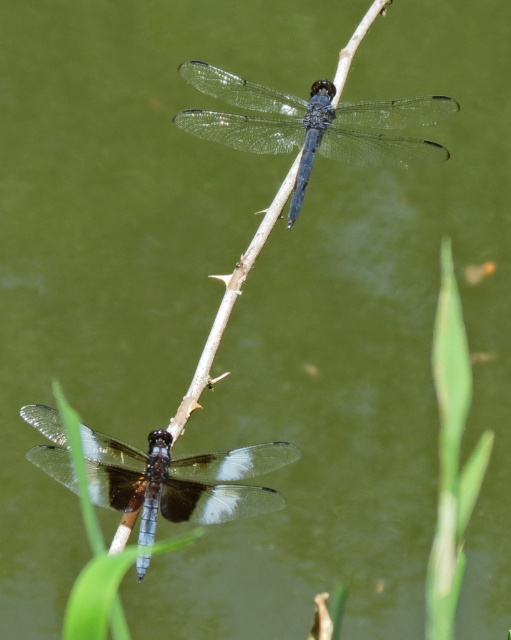
You are an entomologist studying dragonflies. You observe two dragonflies on a twig in the scene. Which dragonfly has a greater height between the transparent glass dragonfly at upper center and the translucent glass dragonfly at lower center?

The transparent glass dragonfly at upper center is taller than the translucent glass dragonfly at lower center according to the description.

You are a bird flying above a pond and want to land on the twig where the transparent glass dragonfly at upper center and the translucent glass dragonfly at lower center are resting. If your wingspan is 30 inches, will you be able to perch between them without touching either dragonfly?

The distance between the transparent glass dragonfly at upper center and the translucent glass dragonfly at lower center is 28.64 inches. Since your wingspan is 30 inches, which is slightly wider than the space between them, you would not be able to perch between them without overlapping the dragonflies.